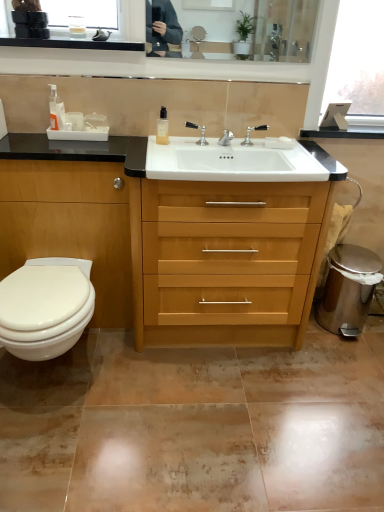
You are a GUI agent. You are given a task and a screenshot of the screen. Output one action in this format:
    pyautogui.click(x=<x>, y=<y>)
    Task: Click on the free space above light wood/finish chest of drawers at center (from a real-world perspective)
    
    Given the screenshot: What is the action you would take?
    pyautogui.click(x=225, y=157)